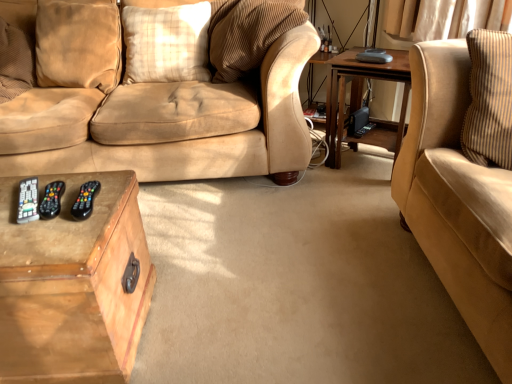
The image size is (512, 384). I want to click on black plastic remote at lower left, so click(28, 201).

What is the approximate width of black plastic remote at lower left?

It is 9.34 inches.

Locate an element on the screen. plaid fabric pillow at center, the second pillow positioned from the left is located at coordinates (166, 43).

You are a GUI agent. You are given a task and a screenshot of the screen. Output one action in this format:
    pyautogui.click(x=<x>, y=<y>)
    Task: Click on the table in front of the wooden table at right, the 1th table positioned from the right
    This screenshot has width=512, height=384.
    Given the screenshot: What is the action you would take?
    pyautogui.click(x=72, y=286)

Which of these two, wooden trunk at lower left, the 1th table from the left, or wooden table at right, the 1th table viewed from the back, is bigger?

wooden trunk at lower left, the 1th table from the left.

From a real-world perspective, which object rests below the other?

From a 3D spatial view, wooden trunk at lower left, which is counted as the 1th table, starting from the bottom, is below.

From a real-world perspective, which object stands above the other?

From a 3D spatial view, velvet beige pillow at upper left, acting as the 2th pillow starting from the right, is above.

Is velvet beige pillow at upper left, arranged as the 1th pillow when viewed from the left, inside wooden trunk at lower left, arranged as the second table when viewed from the right?

No.

Based on the photo, is the surface of wooden trunk at lower left, positioned as the first table in front-to-back order, in direct contact with velvet beige pillow at upper left, arranged as the 1th pillow when viewed from the left?

No, wooden trunk at lower left, positioned as the first table in front-to-back order, is not in contact with velvet beige pillow at upper left, arranged as the 1th pillow when viewed from the left.

Between wooden trunk at lower left, which appears as the second table when viewed from the back, and velvet beige pillow at upper left, acting as the 2th pillow starting from the right, which one has smaller size?

velvet beige pillow at upper left, acting as the 2th pillow starting from the right, is smaller.

From the image's perspective, which object appears higher, velvet beige pillow at upper left, arranged as the 1th pillow when viewed from the left, or wooden trunk at lower left, positioned as the first table in front-to-back order?

velvet beige pillow at upper left, arranged as the 1th pillow when viewed from the left, appears higher in the image.

From a real-world perspective, is velvet beige pillow at upper left, acting as the 2th pillow starting from the right, positioned over wooden trunk at lower left, which is counted as the 1th table, starting from the bottom, based on gravity?

Yes.

Does velvet beige pillow at upper left, acting as the 2th pillow starting from the right, have a larger size compared to wooden trunk at lower left, acting as the second table starting from the top?

Actually, velvet beige pillow at upper left, acting as the 2th pillow starting from the right, might be smaller than wooden trunk at lower left, acting as the second table starting from the top.

Measure the distance from velvet beige pillow at upper left, arranged as the 1th pillow when viewed from the left, to wooden trunk at lower left, arranged as the second table when viewed from the right.

velvet beige pillow at upper left, arranged as the 1th pillow when viewed from the left, and wooden trunk at lower left, arranged as the second table when viewed from the right, are 3.80 feet apart.

Considering the relative sizes of plaid fabric pillow at center, which is counted as the 1th pillow, starting from the right, and black plastic remote at lower left in the image provided, is plaid fabric pillow at center, which is counted as the 1th pillow, starting from the right, taller than black plastic remote at lower left?

Indeed, plaid fabric pillow at center, which is counted as the 1th pillow, starting from the right, has a greater height compared to black plastic remote at lower left.

From the image's perspective, is plaid fabric pillow at center, which is counted as the 1th pillow, starting from the right, under black plastic remote at lower left?

Incorrect, from the image's perspective, plaid fabric pillow at center, which is counted as the 1th pillow, starting from the right, is higher than black plastic remote at lower left.

Is plaid fabric pillow at center, which is counted as the 1th pillow, starting from the right, inside the boundaries of black plastic remote at lower left, or outside?

plaid fabric pillow at center, which is counted as the 1th pillow, starting from the right, is spatially situated outside black plastic remote at lower left.

Considering the relative sizes of velvet beige pillow at upper left, arranged as the 1th pillow when viewed from the left, and suede beige couch at right in the image provided, is velvet beige pillow at upper left, arranged as the 1th pillow when viewed from the left, wider than suede beige couch at right?

Incorrect, the width of velvet beige pillow at upper left, arranged as the 1th pillow when viewed from the left, does not surpass that of suede beige couch at right.

From a real-world perspective, is velvet beige pillow at upper left, acting as the 2th pillow starting from the right, physically located above or below suede beige couch at right?

In terms of real-world spatial position, velvet beige pillow at upper left, acting as the 2th pillow starting from the right, is above suede beige couch at right.

How distant is velvet beige pillow at upper left, acting as the 2th pillow starting from the right, from suede beige couch at right?

5.20 feet.

Which is closer to the camera, (73, 70) or (459, 190)?

Clearly, point (73, 70) is more distant from the camera than point (459, 190).

Considering the relative sizes of velvet beige pillow at upper left, arranged as the 1th pillow when viewed from the left, and wooden table at right, which appears as the 2th table when ordered from the bottom, in the image provided, is velvet beige pillow at upper left, arranged as the 1th pillow when viewed from the left, wider than wooden table at right, which appears as the 2th table when ordered from the bottom,?

No.

Consider the image. From a real-world perspective, relative to wooden table at right, which is counted as the 1th table, starting from the top, is velvet beige pillow at upper left, acting as the 2th pillow starting from the right, vertically above or below?

velvet beige pillow at upper left, acting as the 2th pillow starting from the right, is above wooden table at right, which is counted as the 1th table, starting from the top.

Can you confirm if velvet beige pillow at upper left, arranged as the 1th pillow when viewed from the left, is taller than wooden table at right, the 1th table positioned from the right?

No, velvet beige pillow at upper left, arranged as the 1th pillow when viewed from the left, is not taller than wooden table at right, the 1th table positioned from the right.

Is wooden table at right, the 1th table positioned from the right, in contact with velvet beige pillow at upper left, acting as the 2th pillow starting from the right?

No, wooden table at right, the 1th table positioned from the right, is not beside velvet beige pillow at upper left, acting as the 2th pillow starting from the right.

From a real-world perspective, is wooden table at right, the 1th table positioned from the right, on top of velvet beige pillow at upper left, acting as the 2th pillow starting from the right?

No.

In terms of width, does wooden table at right, the second table viewed from the front, look wider or thinner when compared to velvet beige pillow at upper left, acting as the 2th pillow starting from the right?

Considering their sizes, wooden table at right, the second table viewed from the front, looks broader than velvet beige pillow at upper left, acting as the 2th pillow starting from the right.

Does wooden table at right, the second table viewed from the front, have a lesser height compared to velvet beige pillow at upper left, arranged as the 1th pillow when viewed from the left?

No.

At what (x,y) coordinates should I click in order to perform the action: click on table that appears in front of the wooden table at right, which is counted as the 1th table, starting from the top. Please return your answer as a coordinate pair (x, y). Looking at the image, I should click on (72, 286).

I want to click on pillow on the left of wooden trunk at lower left, the 1th table from the left, so click(78, 44).

Which object lies nearer to the anchor point black plastic remote at lower left, velvet beige pillow at upper left, arranged as the 1th pillow when viewed from the left, or wooden trunk at lower left, which appears as the second table when viewed from the back?

Among the two, wooden trunk at lower left, which appears as the second table when viewed from the back, is located nearer to black plastic remote at lower left.

Considering their positions, is black plastic remote at lower left positioned closer to plaid fabric pillow at center, the second pillow positioned from the left, than suede beige couch at right?

Based on the image, black plastic remote at lower left appears to be nearer to plaid fabric pillow at center, the second pillow positioned from the left.

Considering their positions, is plaid fabric pillow at center, the second pillow positioned from the left, positioned closer to black plastic remote at lower left than velvet beige pillow at upper left, arranged as the 1th pillow when viewed from the left?

velvet beige pillow at upper left, arranged as the 1th pillow when viewed from the left, is closer to black plastic remote at lower left.

When comparing their distances from suede beige couch at right, does plaid fabric pillow at center, which is counted as the 1th pillow, starting from the right, or black plastic remote at lower left seem further?

plaid fabric pillow at center, which is counted as the 1th pillow, starting from the right, is further to suede beige couch at right.

From the image, which object appears to be nearer to plaid fabric pillow at center, which is counted as the 1th pillow, starting from the right, wooden table at right, the 1th table viewed from the back, or velvet beige pillow at upper left, arranged as the 1th pillow when viewed from the left?

Among the two, velvet beige pillow at upper left, arranged as the 1th pillow when viewed from the left, is located nearer to plaid fabric pillow at center, which is counted as the 1th pillow, starting from the right.

Based on the photo, looking at the image, which one is located closer to wooden table at right, the 1th table positioned from the right, plaid fabric pillow at center, the second pillow positioned from the left, or velvet beige pillow at upper left, acting as the 2th pillow starting from the right?

The object closer to wooden table at right, the 1th table positioned from the right, is plaid fabric pillow at center, the second pillow positioned from the left.

Considering their positions, is velvet beige pillow at upper left, arranged as the 1th pillow when viewed from the left, positioned further to wooden table at right, the second table positioned from the left, than plaid fabric pillow at center, which is counted as the 1th pillow, starting from the right?

The object further to wooden table at right, the second table positioned from the left, is velvet beige pillow at upper left, arranged as the 1th pillow when viewed from the left.

Which object lies nearer to the anchor point plaid fabric pillow at center, the second pillow positioned from the left, suede beige couch at right or black plastic remote at lower left?

Among the two, black plastic remote at lower left is located nearer to plaid fabric pillow at center, the second pillow positioned from the left.

Locate an element on the screen. remote situated between velvet beige pillow at upper left, arranged as the 1th pillow when viewed from the left, and wooden table at right, which appears as the 2th table when ordered from the bottom, from left to right is located at coordinates (28, 201).

Locate an element on the screen. This screenshot has width=512, height=384. table between wooden trunk at lower left, positioned as the first table in front-to-back order, and suede beige couch at right is located at coordinates (360, 92).

Find the location of a particular element. This screenshot has width=512, height=384. pillow between velvet beige pillow at upper left, arranged as the 1th pillow when viewed from the left, and wooden table at right, the second table viewed from the front, in the horizontal direction is located at coordinates (166, 43).

Identify the location of pillow between black plastic remote at lower left and wooden table at right, the second table viewed from the front. Image resolution: width=512 pixels, height=384 pixels. (166, 43).